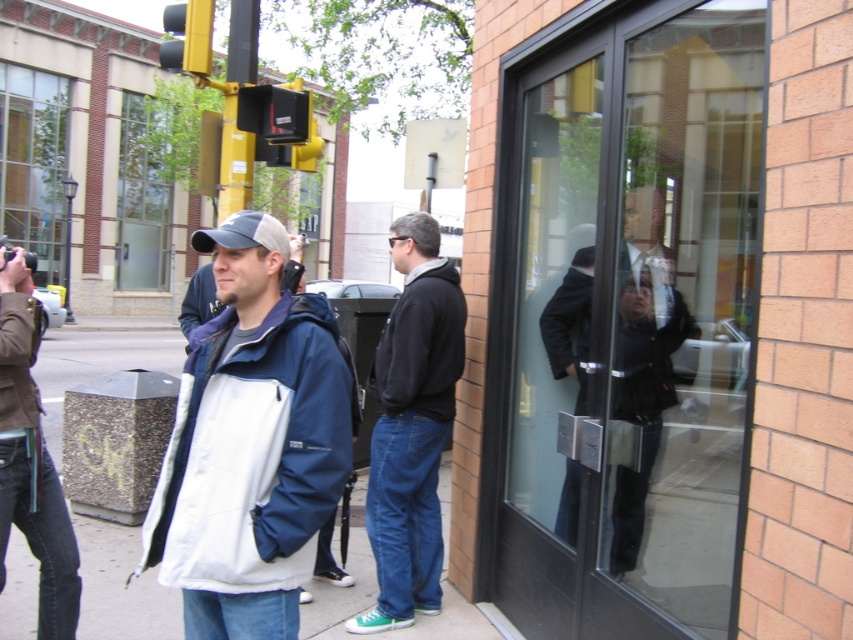
Question: Can you confirm if white fabric pavement at center is smaller than brown leather jacket at left?

Choices:
 (A) yes
 (B) no

Answer: (B)

Question: Can you confirm if white matte jacket at center is positioned to the left of dark blue hoodie at center?

Choices:
 (A) no
 (B) yes

Answer: (B)

Question: Among these objects, which one is nearest to the camera?

Choices:
 (A) black plastic traffic light at upper center
 (B) white fabric pavement at center
 (C) dark suit at center
 (D) transparent glass door at center

Answer: (D)

Question: Can you confirm if white fabric pavement at center is positioned to the left of dark suit at center?

Choices:
 (A) yes
 (B) no

Answer: (A)

Question: Which of the following is the closest to the observer?

Choices:
 (A) yellow plastic traffic light at upper center
 (B) black plastic traffic light at upper center
 (C) dark blue hoodie at center

Answer: (C)

Question: Which object appears farthest from the camera in this image?

Choices:
 (A) black plastic traffic light at upper center
 (B) brown leather jacket at left
 (C) white matte jacket at center

Answer: (A)